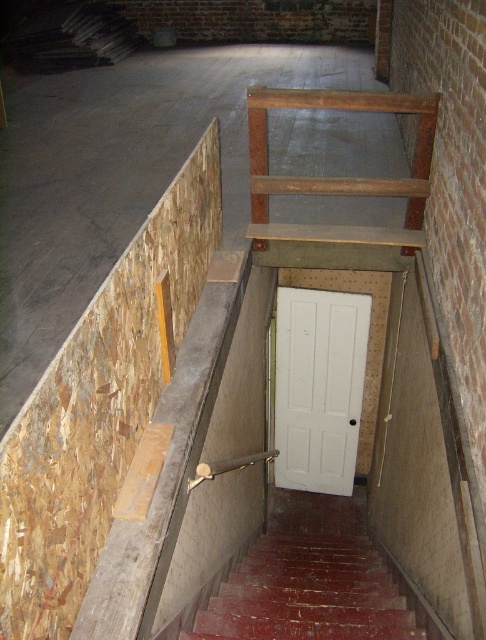
Question: Which is nearer to the rusty metal stairs at lower center?

Choices:
 (A) white painted wood door at center
 (B) wooden at upper center

Answer: (A)

Question: Which of the following is the farthest from the observer?

Choices:
 (A) wooden at upper center
 (B) white painted wood door at center
 (C) rusty metal stairs at lower center

Answer: (B)

Question: Is rusty metal stairs at lower center to the left of wooden at upper center from the viewer's perspective?

Choices:
 (A) no
 (B) yes

Answer: (B)

Question: Is rusty metal stairs at lower center behind white painted wood door at center?

Choices:
 (A) yes
 (B) no

Answer: (B)

Question: Is rusty metal stairs at lower center to the left of white painted wood door at center from the viewer's perspective?

Choices:
 (A) no
 (B) yes

Answer: (B)

Question: Which object is farther from the camera taking this photo?

Choices:
 (A) wooden at upper center
 (B) rusty metal stairs at lower center

Answer: (A)